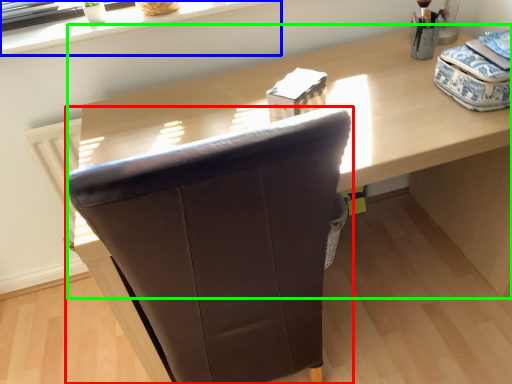
Question: Considering the real-world distances, which object is closest to chair (highlighted by a red box)? window sill (highlighted by a blue box) or computer desk (highlighted by a green box).

Choices:
 (A) window sill
 (B) computer desk

Answer: (B)